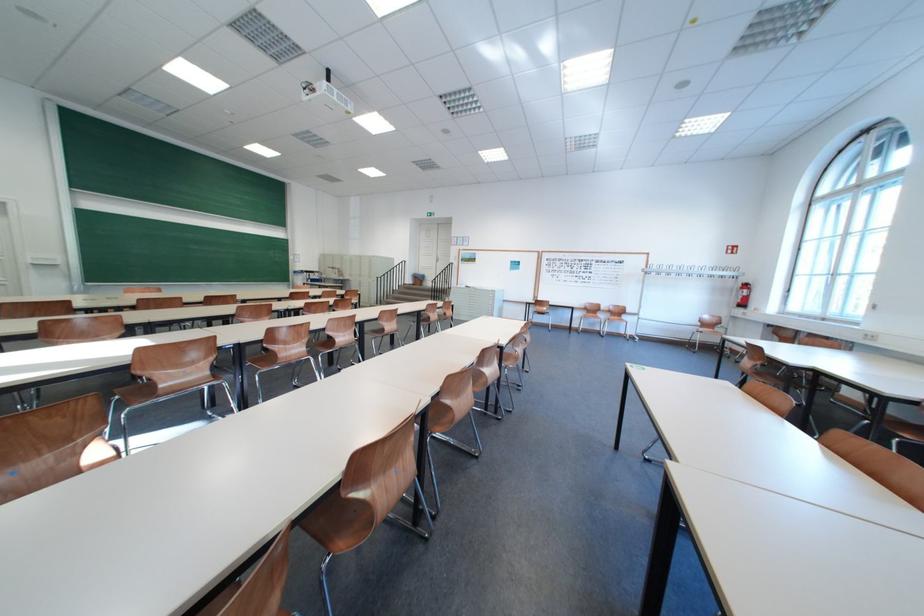
This screenshot has width=924, height=616. What do you see at coordinates (442, 256) in the screenshot?
I see `the white door handle` at bounding box center [442, 256].